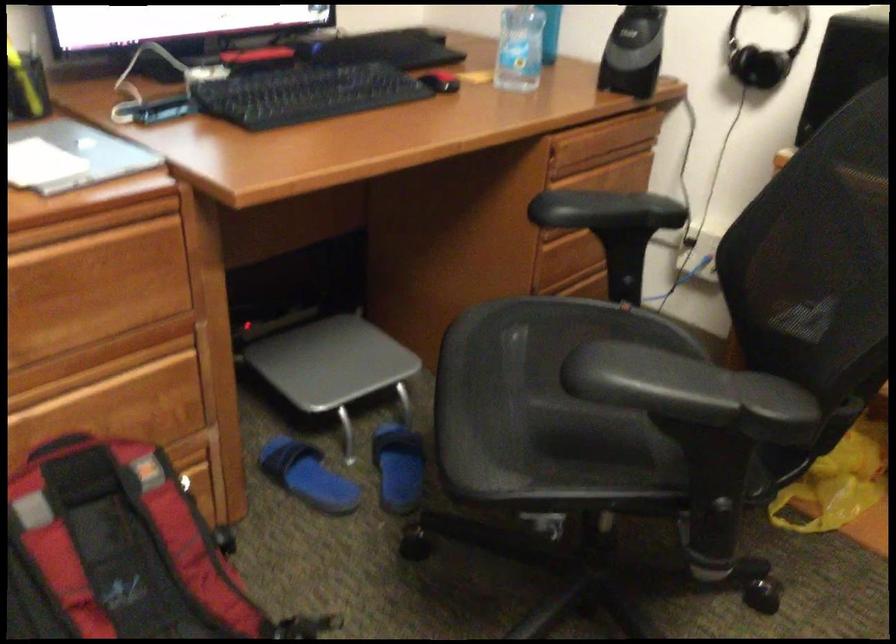
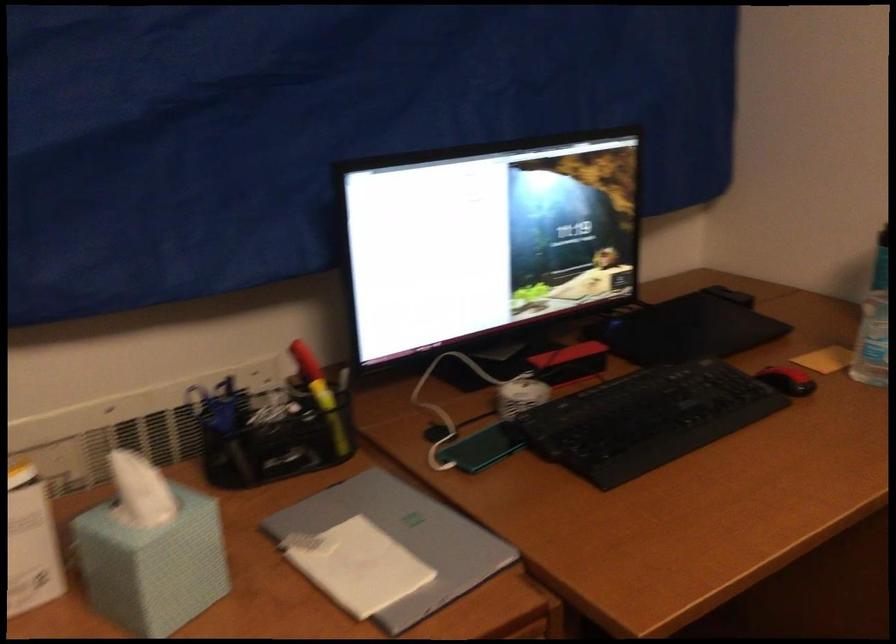
In a continuous first-person perspective shot, in which direction is the camera moving?

The cameraman moved toward left, forward.